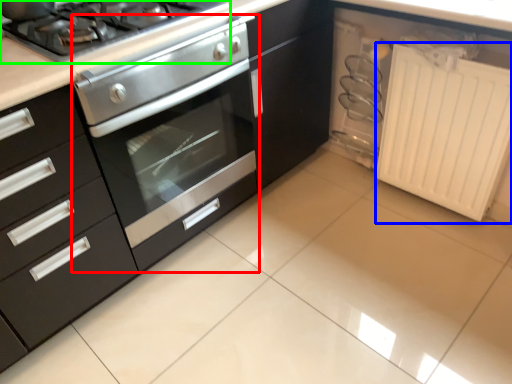
Question: Based on their relative distances, which object is farther from oven (highlighted by a red box)? Choose from radiator (highlighted by a blue box) and gas stove (highlighted by a green box).

Choices:
 (A) radiator
 (B) gas stove

Answer: (A)